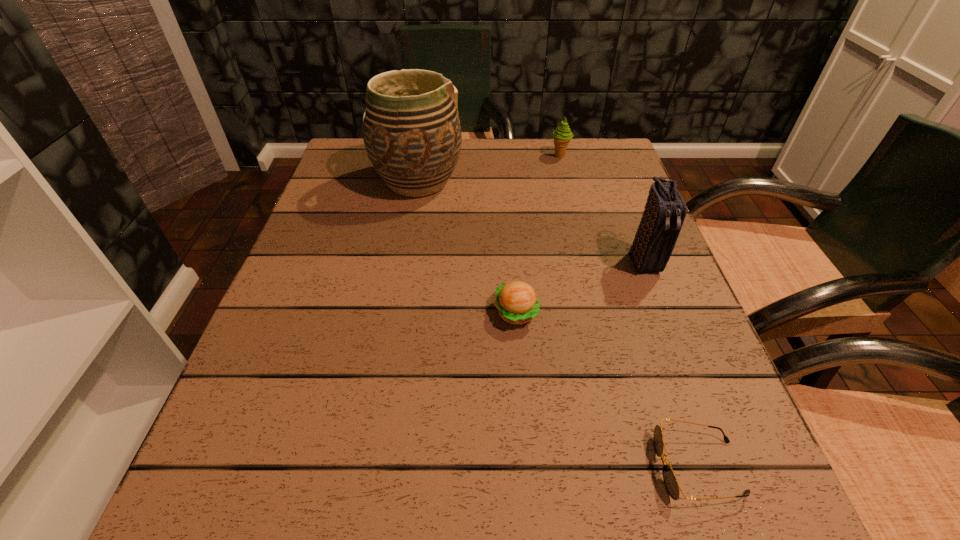
Image resolution: width=960 pixels, height=540 pixels. In order to click on blank space located 0.390m with the zip open on the clutch bag in this screenshot , I will do `click(732, 487)`.

The image size is (960, 540). What are the coordinates of `vacant position located 0.210m on the front of the icecream` in the screenshot? It's located at (572, 207).

I want to click on blank space located 0.270m on the left of the hamburger, so [347, 313].

At what (x,y) coordinates should I click in order to perform the action: click on blank space located on the front-facing side of the sunglasses. Please return your answer as a coordinate pair (x, y). The image size is (960, 540). Looking at the image, I should click on (413, 467).

Image resolution: width=960 pixels, height=540 pixels. Find the location of `free space located 0.390m on the front-facing side of the sunglasses`. free space located 0.390m on the front-facing side of the sunglasses is located at coordinates (376, 467).

Where is `free space located on the front-facing side of the sunglasses`? The image size is (960, 540). free space located on the front-facing side of the sunglasses is located at coordinates (564, 467).

Find the location of a particular element. The image size is (960, 540). pottery at the far edge is located at coordinates (411, 129).

Identify the location of icecream located at the far edge. This screenshot has width=960, height=540. (562, 135).

Locate an element on the screen. Image resolution: width=960 pixels, height=540 pixels. object at the near edge is located at coordinates (670, 481).

Locate an element on the screen. The height and width of the screenshot is (540, 960). object positioned at the left edge is located at coordinates (411, 129).